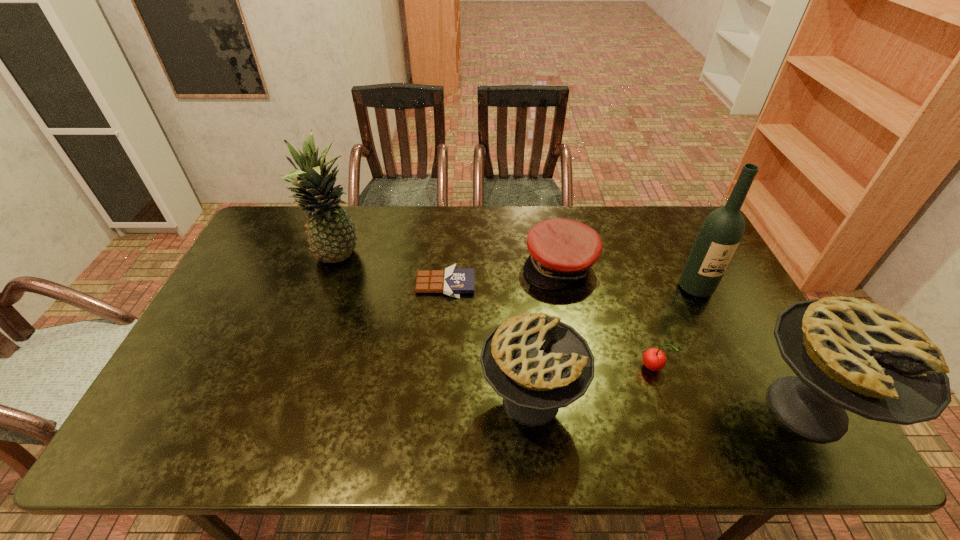
What are the coordinates of `vacant area between the right pie and the wine bottle` in the screenshot? It's located at (751, 348).

Find the location of `unoccupied position between the third object from right to left and the wine bottle`. unoccupied position between the third object from right to left and the wine bottle is located at coordinates (674, 328).

At what (x,y) coordinates should I click in order to perform the action: click on free space between the fourth tallest object and the third tallest object. Please return your answer as a coordinate pair (x, y). The width and height of the screenshot is (960, 540). Looking at the image, I should click on (668, 404).

Image resolution: width=960 pixels, height=540 pixels. What are the coordinates of `vacant point located between the cap and the right pie` in the screenshot? It's located at (683, 336).

The height and width of the screenshot is (540, 960). What are the coordinates of `unoccupied position between the pineapple and the cap` in the screenshot? It's located at (449, 262).

Where is `vacant space in between the wine bottle and the fifth shortest object`? vacant space in between the wine bottle and the fifth shortest object is located at coordinates (751, 348).

Image resolution: width=960 pixels, height=540 pixels. I want to click on vacant area that lies between the pineapple and the fifth object from left to right, so click(x=495, y=313).

I want to click on the fifth closest object to the chocolate bar, so click(x=721, y=232).

Select which object is the fourth closest to the cap. Please provide its 2D coordinates. Your answer should be formatted as a tuple, i.e. [(x, y)], where the tuple contains the x and y coordinates of a point satisfying the conditions above.

[(654, 359)]

Locate an element on the screen. The height and width of the screenshot is (540, 960). free location that satisfies the following two spatial constraints: 1. on the front side of the third object from right to left; 2. on the cut side of the fourth tallest object is located at coordinates (662, 401).